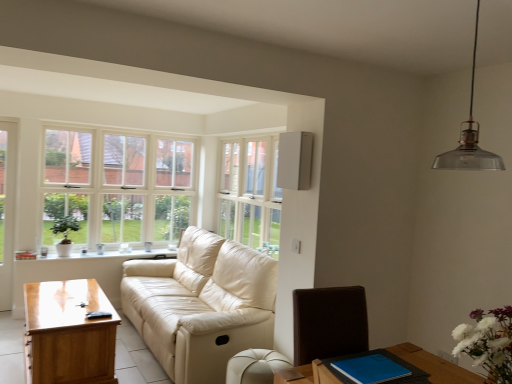
Where is `transparent glass pendant lamp at upper right`? The image size is (512, 384). transparent glass pendant lamp at upper right is located at coordinates (469, 136).

Measure the distance between point (471, 127) and camera.

Point (471, 127) and camera are 2.68 meters apart.

What do you see at coordinates (250, 194) in the screenshot? This screenshot has height=384, width=512. I see `white wooden window at upper center, which is counted as the first window, starting from the right` at bounding box center [250, 194].

Identify the location of beige leather couch at center. The height and width of the screenshot is (384, 512). (201, 304).

Image resolution: width=512 pixels, height=384 pixels. Describe the element at coordinates (488, 342) in the screenshot. I see `white matte flowers at lower right` at that location.

What do you see at coordinates (7, 209) in the screenshot? I see `white glass screen door at left` at bounding box center [7, 209].

Describe the element at coordinates (435, 365) in the screenshot. Image resolution: width=512 pixels, height=384 pixels. I see `blue leather book at lower right, placed as the 2th table when sorted from bottom to top` at that location.

Find the location of a particular element. The width and height of the screenshot is (512, 384). blue leather book at lower right, placed as the 2th table when sorted from bottom to top is located at coordinates (435, 365).

Where is `white wooden window at upper left, the 2th window positioned from the right`? white wooden window at upper left, the 2th window positioned from the right is located at coordinates (144, 188).

Would you say beige leather couch at center is inside or outside white wooden window at upper center, which is counted as the first window, starting from the right?

beige leather couch at center cannot be found inside white wooden window at upper center, which is counted as the first window, starting from the right.

Between beige leather couch at center and white wooden window at upper center, which is counted as the first window, starting from the right, which one has more height?

white wooden window at upper center, which is counted as the first window, starting from the right.

Does point (218, 274) come closer to viewer compared to point (247, 196)?

Yes, point (218, 274) is in front of point (247, 196).

Between beige leather couch at center and white wooden window at upper center, marked as the 2th window in a left-to-right arrangement, which one is positioned behind?

white wooden window at upper center, marked as the 2th window in a left-to-right arrangement.

Can we say blue leather book at lower right, the first table from the top, lies outside white leather ottoman at lower center?

That's correct, blue leather book at lower right, the first table from the top, is outside of white leather ottoman at lower center.

Can you confirm if blue leather book at lower right, the first table from the top, is bigger than white leather ottoman at lower center?

No.

Considering the sizes of objects blue leather book at lower right, placed as the 2th table when sorted from bottom to top, and white leather ottoman at lower center in the image provided, who is thinner, blue leather book at lower right, placed as the 2th table when sorted from bottom to top, or white leather ottoman at lower center?

Thinner between the two is white leather ottoman at lower center.

Find the location of a particular element. armchair located below the blue leather book at lower right, the 2th table viewed from the back (from the image's perspective) is located at coordinates (255, 366).

Considering the positions of objects white leather ottoman at lower center and beige leather couch at center in the image provided, who is more to the right, white leather ottoman at lower center or beige leather couch at center?

white leather ottoman at lower center.

How many degrees apart are the facing directions of white leather ottoman at lower center and beige leather couch at center?

There is a 1.23-degree angle between the facing directions of white leather ottoman at lower center and beige leather couch at center.

Which is correct: white leather ottoman at lower center is inside beige leather couch at center, or outside of it?

white leather ottoman at lower center cannot be found inside beige leather couch at center.

From a real-world perspective, which object rests below the other?

blue leather book at lower right, the 2th table viewed from the back, is physically lower.

Would you say transparent glass pendant lamp at upper right is to the left or to the right of blue leather book at lower right, the 2th table viewed from the left, in the picture?

transparent glass pendant lamp at upper right is positioned on blue leather book at lower right, the 2th table viewed from the left,'s right side.

Between transparent glass pendant lamp at upper right and blue leather book at lower right, which is counted as the 1th table, starting from the front, which one has larger width?

blue leather book at lower right, which is counted as the 1th table, starting from the front.

Who is shorter, transparent glass pendant lamp at upper right or blue leather book at lower right, the 2th table viewed from the back?

blue leather book at lower right, the 2th table viewed from the back, is shorter.

Which object is further away from the camera taking this photo, blue leather book at lower right, the 2th table viewed from the left, or white wooden window at upper left, the 2th window positioned from the right?

white wooden window at upper left, the 2th window positioned from the right, is behind.

Is blue leather book at lower right, which is counted as the 1th table, starting from the front, oriented towards white wooden window at upper left, the 1th window when ordered from left to right?

No.

From a real-world perspective, who is located lower, blue leather book at lower right, the 2th table viewed from the left, or white wooden window at upper left, the 2th window positioned from the right?

In real-world perspective, blue leather book at lower right, the 2th table viewed from the left, is lower.

Is blue leather book at lower right, the 2th table viewed from the back, not inside white wooden window at upper left, the 2th window positioned from the right?

Yes.

Is point (79, 166) farther from viewer compared to point (16, 124)?

Yes, point (79, 166) is farther from viewer.

Are white wooden window at upper left, the 2th window positioned from the right, and white glass screen door at left far apart?

Yes, white wooden window at upper left, the 2th window positioned from the right, is far from white glass screen door at left.

From a real-world perspective, is white wooden window at upper left, the 1th window when ordered from left to right, above or below white glass screen door at left?

In terms of real-world spatial position, white wooden window at upper left, the 1th window when ordered from left to right, is above white glass screen door at left.

Considering the sizes of white wooden window at upper left, the 1th window when ordered from left to right, and white glass screen door at left in the image, is white wooden window at upper left, the 1th window when ordered from left to right, wider or thinner than white glass screen door at left?

white wooden window at upper left, the 1th window when ordered from left to right, is wider than white glass screen door at left.

Which of these two, white wooden window at upper left, the 2th window positioned from the right, or beige leather couch at center, is wider?

Wider between the two is beige leather couch at center.

What's the angular difference between white wooden window at upper left, the 2th window positioned from the right, and beige leather couch at center's facing directions?

89.5 degrees separate the facing orientations of white wooden window at upper left, the 2th window positioned from the right, and beige leather couch at center.

Is white wooden window at upper left, the 2th window positioned from the right, shorter than beige leather couch at center?

Incorrect, the height of white wooden window at upper left, the 2th window positioned from the right, does not fall short of that of beige leather couch at center.

Is white wooden window at upper left, the 1th window when ordered from left to right, looking in the opposite direction of beige leather couch at center?

That's not correct — white wooden window at upper left, the 1th window when ordered from left to right, is not looking away from beige leather couch at center.

Locate an element on the screen. The height and width of the screenshot is (384, 512). window that is the 1st object located behind the beige leather couch at center is located at coordinates (250, 194).

Identify the location of the 2nd table above the white leather ottoman at lower center (from the image's perspective). (435, 365).

From the image, which object appears to be nearer to white leather ottoman at lower center, white matte flowers at lower right or white wooden window at upper center, which is counted as the first window, starting from the right?

The object closer to white leather ottoman at lower center is white matte flowers at lower right.

Based on their spatial positions, is white glass screen door at left or white matte flowers at lower right closer to beige leather couch at center?

Among the two, white glass screen door at left is located nearer to beige leather couch at center.

Looking at the image, which one is located further to light brown wooden table at lower left, the second table when ordered from right to left, transparent glass pendant lamp at upper right or white wooden window at upper center, marked as the 2th window in a left-to-right arrangement?

The object further to light brown wooden table at lower left, the second table when ordered from right to left, is transparent glass pendant lamp at upper right.

Which object lies nearer to the anchor point blue leather book at lower right, placed as the 2th table when sorted from bottom to top, white ceramic window sill at lower left or white matte flowers at lower right?

white matte flowers at lower right is positioned closer to the anchor blue leather book at lower right, placed as the 2th table when sorted from bottom to top.

Which object lies nearer to the anchor point white leather ottoman at lower center, white glass screen door at left or transparent glass pendant lamp at upper right?

transparent glass pendant lamp at upper right lies closer to white leather ottoman at lower center than the other object.

Looking at the image, which one is located closer to transparent glass pendant lamp at upper right, white wooden window at upper center, which is counted as the first window, starting from the right, or white ceramic window sill at lower left?

white wooden window at upper center, which is counted as the first window, starting from the right, is closer to transparent glass pendant lamp at upper right.

When comparing their distances from white leather ottoman at lower center, does transparent glass pendant lamp at upper right or light brown wooden table at lower left, the second table when ordered from right to left, seem closer?

Based on the image, light brown wooden table at lower left, the second table when ordered from right to left, appears to be nearer to white leather ottoman at lower center.

Which object lies further to the anchor point white wooden window at upper center, which is counted as the first window, starting from the right, white ceramic window sill at lower left or light brown wooden table at lower left, which ranks as the 2th table in front-to-back order?

Based on the image, light brown wooden table at lower left, which ranks as the 2th table in front-to-back order, appears to be further to white wooden window at upper center, which is counted as the first window, starting from the right.

Find the location of a particular element. armchair positioned between blue leather book at lower right, the first table from the top, and white ceramic window sill at lower left from near to far is located at coordinates (255, 366).

The image size is (512, 384). Find the location of `window sill located between white glass screen door at left and white wooden window at upper center, marked as the 2th window in a left-to-right arrangement, in the left-right direction`. window sill located between white glass screen door at left and white wooden window at upper center, marked as the 2th window in a left-to-right arrangement, in the left-right direction is located at coordinates (106, 255).

Find the location of a particular element. The width and height of the screenshot is (512, 384). armchair positioned between blue leather book at lower right, the first table from the top, and white wooden window at upper center, marked as the 2th window in a left-to-right arrangement, from near to far is located at coordinates (255, 366).

At what (x,y) coordinates should I click in order to perform the action: click on armchair located between white matte flowers at lower right and white wooden window at upper center, marked as the 2th window in a left-to-right arrangement, in the depth direction. Please return your answer as a coordinate pair (x, y). This screenshot has width=512, height=384. Looking at the image, I should click on (255, 366).